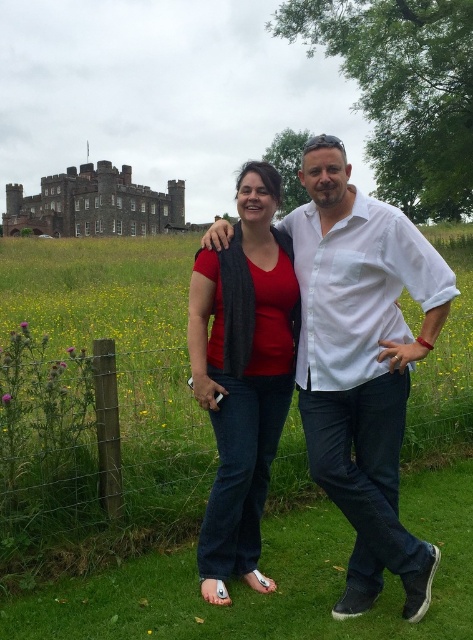
Is point (446, 275) in front of point (89, 227)?

That is True.

Between point (376, 572) and point (17, 198), which one is positioned behind?

The point (17, 198) is behind.

You are a GUI agent. You are given a task and a screenshot of the screen. Output one action in this format:
    pyautogui.click(x=<x>, y=<y>)
    Task: Click on the white cotton shirt at center
    This screenshot has width=473, height=640.
    Given the screenshot: What is the action you would take?
    pyautogui.click(x=362, y=364)

Does point (19, 426) come behind point (390, 312)?

No, it is not.

Which is in front, point (420, 413) or point (411, 588)?

Positioned in front is point (411, 588).

Between point (143, 422) and point (359, 509), which one is positioned behind?

The point (143, 422) is more distant.

At what (x,y) coordinates should I click in order to perform the action: click on wire mesh fence at lower center. Please return your answer as a coordinate pair (x, y). Image resolution: width=473 pixels, height=640 pixels. Looking at the image, I should click on (96, 451).

In the scene shown: Does white cotton shirt at center have a lesser height compared to matte red shirt at center?

No.

Who is lower down, white cotton shirt at center or matte red shirt at center?

matte red shirt at center

Is point (395, 228) positioned in front of point (254, 397)?

Yes, point (395, 228) is closer to viewer.

Locate an element on the screen. This screenshot has width=473, height=640. white cotton shirt at center is located at coordinates coord(362,364).